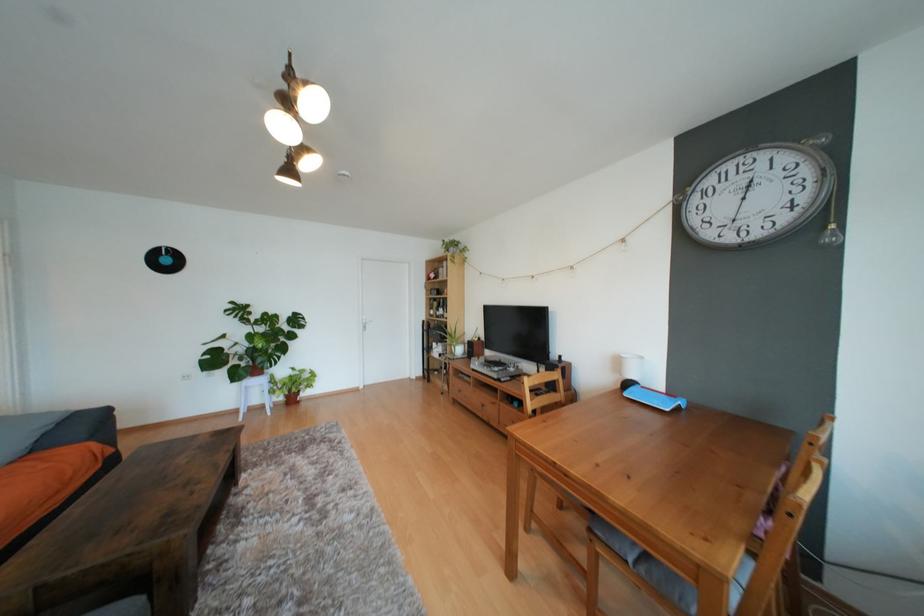
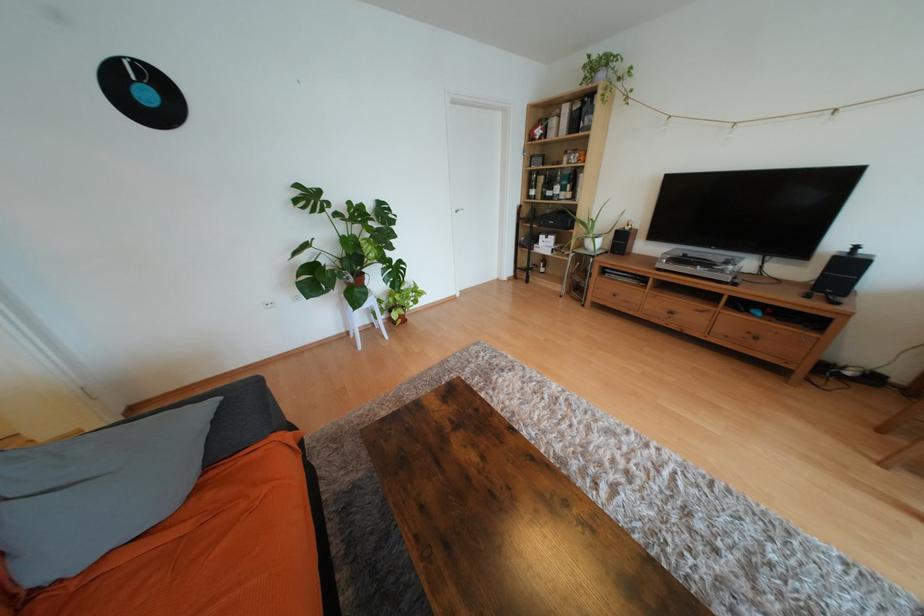
What movement of the cameraman would produce the second image?

The cameraman moved toward left, forward.